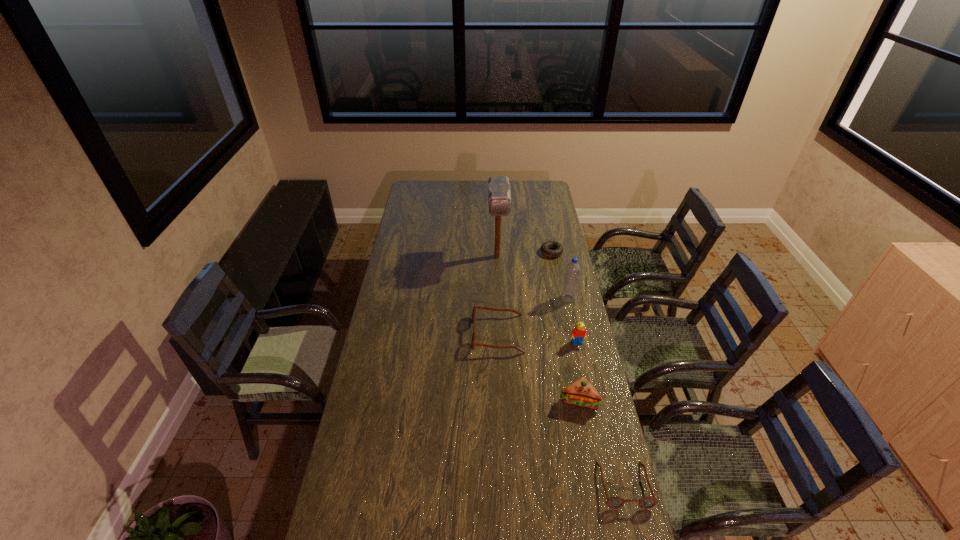
Observe the arrangement of all spectacless in the image. To keep them evenly spaced, where would you place another spectacles on the left? Please locate a free space. Please provide its 2D coordinates. Your answer should be formatted as a tuple, i.e. [(x, y)], where the tuple contains the x and y coordinates of a point satisfying the conditions above.

[(422, 244)]